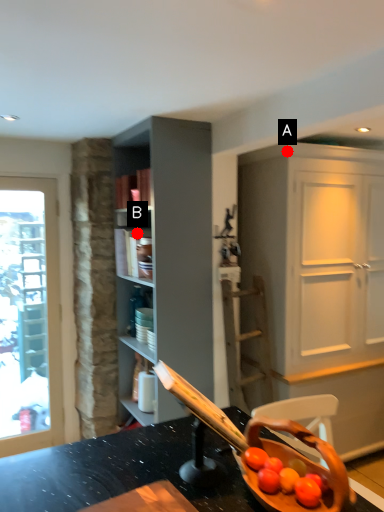
Question: Two points are circled on the image, labeled by A and B beside each circle. Which point is farther from the camera taking this photo?

Choices:
 (A) A is further
 (B) B is further

Answer: (B)